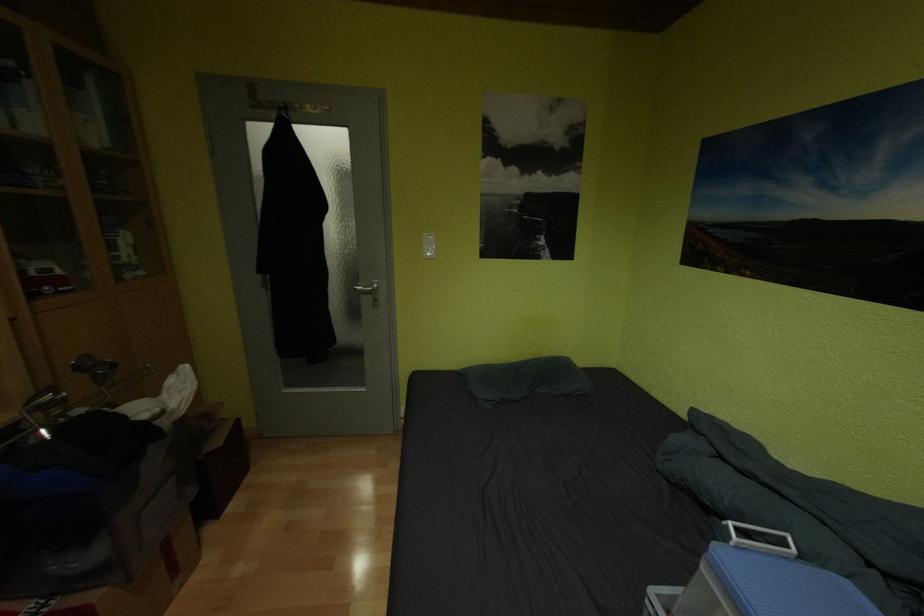
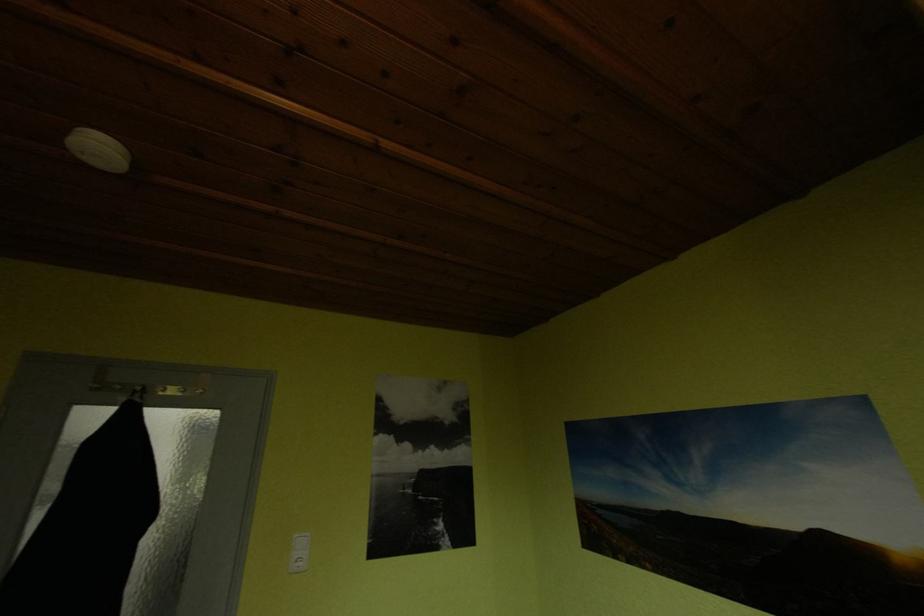
First-person continuous shooting, in which direction is the camera rotating?

The camera rotated toward right-up.